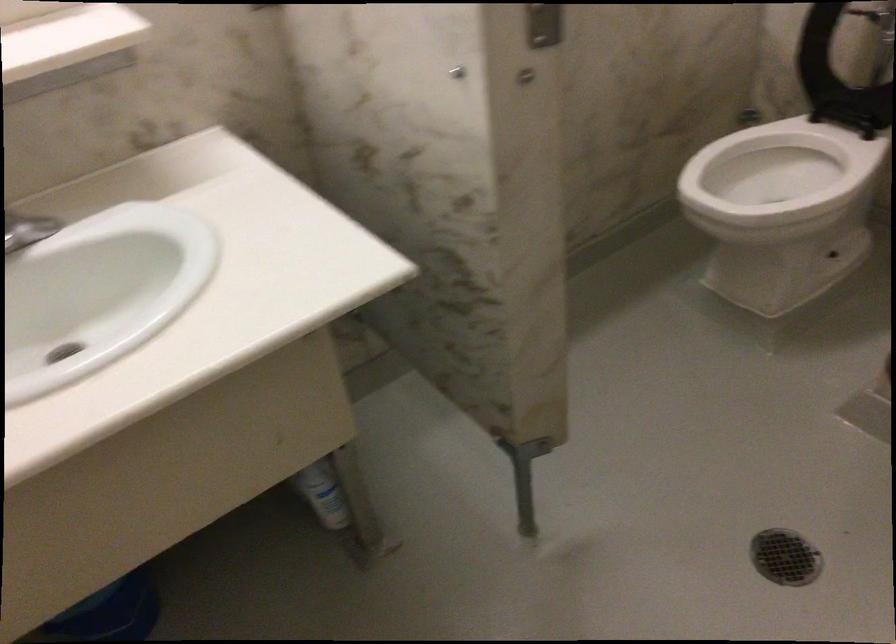
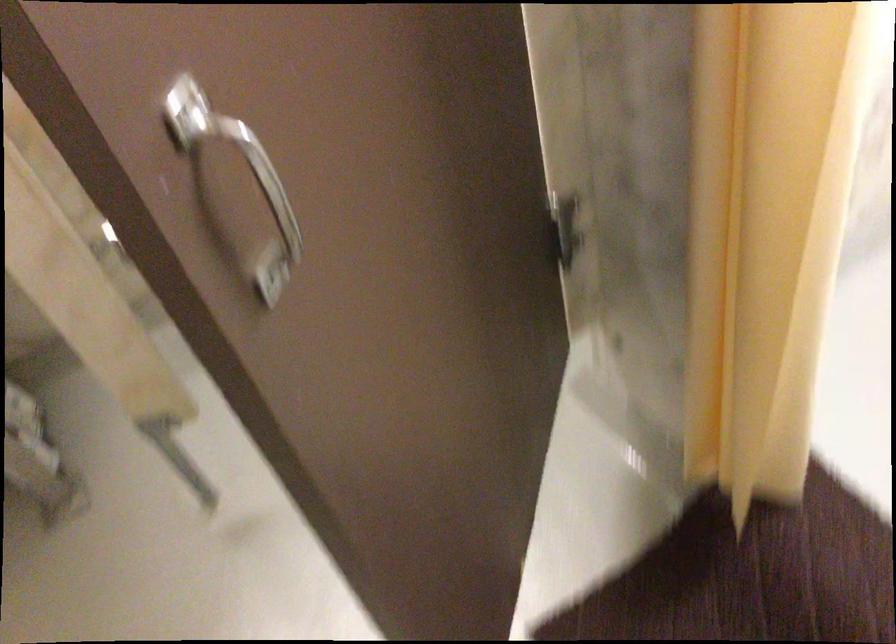
Question: Based on the continuous images, in which direction is the camera rotating? Reply with the corresponding letter.

Choices:
 (A) Left
 (B) Right
 (C) Up
 (D) Down

Answer: (A)